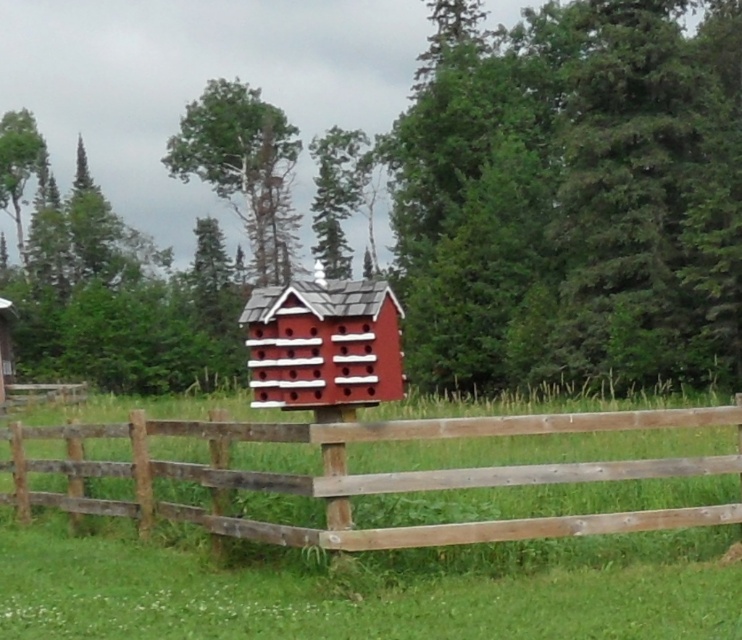
You are a painter who wants to paint the wooden fence at center and the matte red wooden birdhouse at center. If you have enough paint to cover only one of them, which object should you choose to paint first based on their sizes?

The wooden fence at center occupies less space than matte red wooden birdhouse at center, so you should paint the matte red wooden birdhouse at center first since it is larger and requires more paint.

You are standing in front of the fence with the red birdhouse. There are two points marked on the fence at coordinates point (718,456) and point (295,385). If you want to touch the point that is closer to you, which one should you choose?

You should choose point (295,385) because it is closer to you than point (718,456), which is further away.

You are a bird looking for a place to nest. You see the wooden fence at center and the matte red wooden birdhouse at center. Which one is closer to your left side?

The matte red wooden birdhouse at center is closer to your left side because the wooden fence at center is to its right.